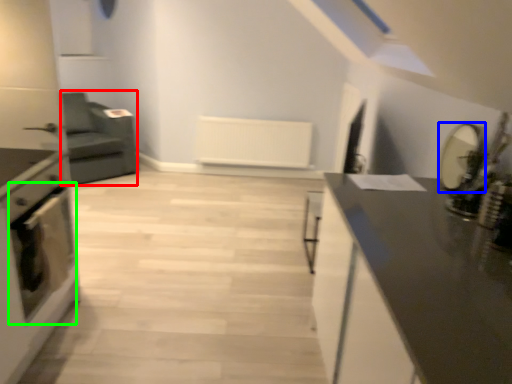
Question: Considering the real-world distances, which object is farthest from armchair (highlighted by a red box)? appliance (highlighted by a blue box) or oven (highlighted by a green box)?

Choices:
 (A) appliance
 (B) oven

Answer: (A)